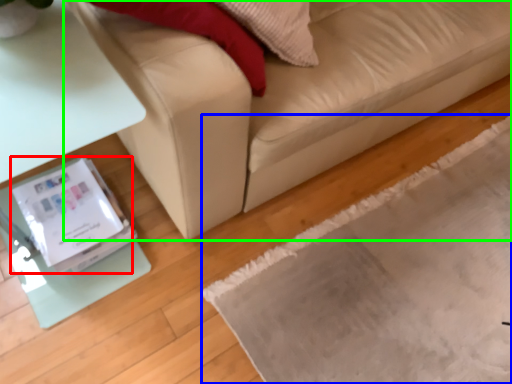
Question: Considering the real-world distances, which object is farthest from Wii (highlighted by a red box)? mat (highlighted by a blue box) or studio couch (highlighted by a green box)?

Choices:
 (A) mat
 (B) studio couch

Answer: (A)